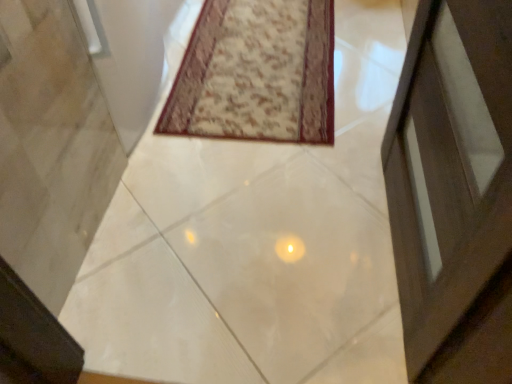
Question: Can you confirm if beige textured rug at center is wider than white glossy concrete at center?

Choices:
 (A) yes
 (B) no

Answer: (B)

Question: Considering the relative positions of beige textured rug at center and white glossy concrete at center in the image provided, is beige textured rug at center to the right of white glossy concrete at center from the viewer's perspective?

Choices:
 (A) yes
 (B) no

Answer: (B)

Question: Does beige textured rug at center have a smaller size compared to white glossy concrete at center?

Choices:
 (A) yes
 (B) no

Answer: (A)

Question: From a real-world perspective, is beige textured rug at center under white glossy concrete at center?

Choices:
 (A) yes
 (B) no

Answer: (B)

Question: Is beige textured rug at center turned away from white glossy concrete at center?

Choices:
 (A) no
 (B) yes

Answer: (B)

Question: Is beige textured rug at center closer to the viewer compared to white glossy concrete at center?

Choices:
 (A) yes
 (B) no

Answer: (B)

Question: Is white glossy concrete at center to the right of beige textured rug at center from the viewer's perspective?

Choices:
 (A) yes
 (B) no

Answer: (A)

Question: Can you confirm if white glossy concrete at center is smaller than beige textured rug at center?

Choices:
 (A) yes
 (B) no

Answer: (B)

Question: Considering the relative sizes of white glossy concrete at center and beige textured rug at center in the image provided, is white glossy concrete at center shorter than beige textured rug at center?

Choices:
 (A) no
 (B) yes

Answer: (A)

Question: Is white glossy concrete at center with beige textured rug at center?

Choices:
 (A) no
 (B) yes

Answer: (A)

Question: From the image's perspective, is white glossy concrete at center above beige textured rug at center?

Choices:
 (A) yes
 (B) no

Answer: (B)

Question: Is white glossy concrete at center at the left side of beige textured rug at center?

Choices:
 (A) no
 (B) yes

Answer: (A)

Question: Relative to white glossy concrete at center, is beige textured rug at center in front or behind?

Choices:
 (A) front
 (B) behind

Answer: (B)